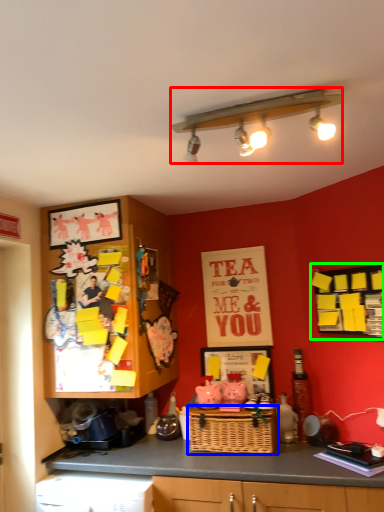
Question: Based on their relative distances, which object is farther from light fixture (highlighted by a red box)? Choose from basket (highlighted by a blue box) and bulletin board (highlighted by a green box).

Choices:
 (A) basket
 (B) bulletin board

Answer: (A)